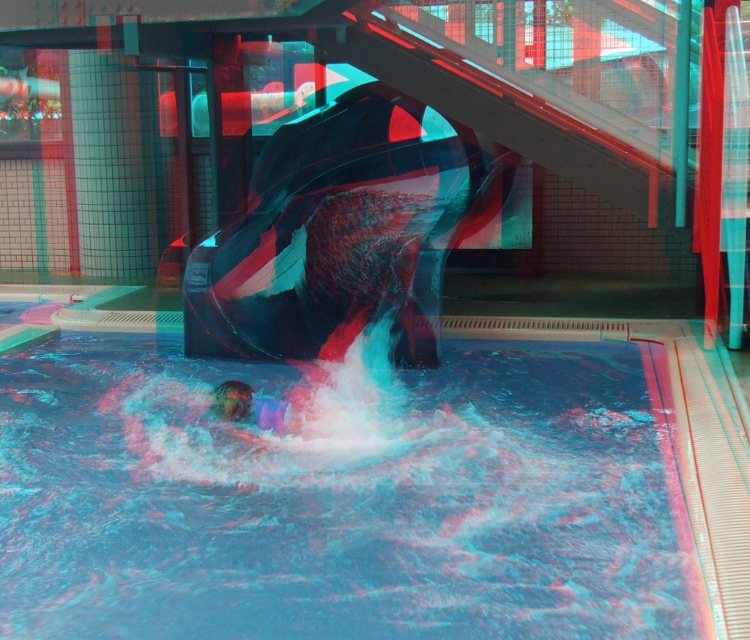
Question: Is blue rubber pool at center positioned behind translucent purple swimmer at center?

Choices:
 (A) yes
 (B) no

Answer: (B)

Question: Does blue rubber pool at center have a greater width compared to translucent purple swimmer at center?

Choices:
 (A) no
 (B) yes

Answer: (B)

Question: Which object is farther from the camera taking this photo?

Choices:
 (A) blue rubber pool at center
 (B) translucent purple swimmer at center

Answer: (B)

Question: Is blue rubber pool at center below translucent purple swimmer at center?

Choices:
 (A) yes
 (B) no

Answer: (A)